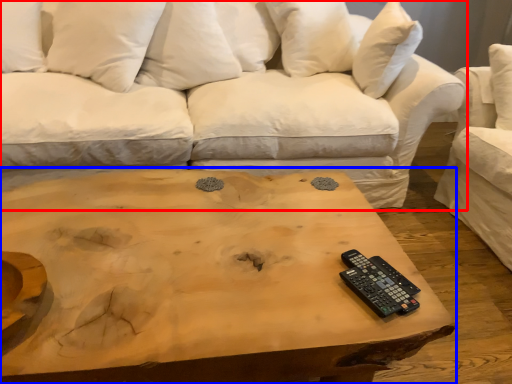
Question: Which of the following is the farthest to the observer, studio couch (highlighted by a red box) or coffee table (highlighted by a blue box)?

Choices:
 (A) studio couch
 (B) coffee table

Answer: (A)